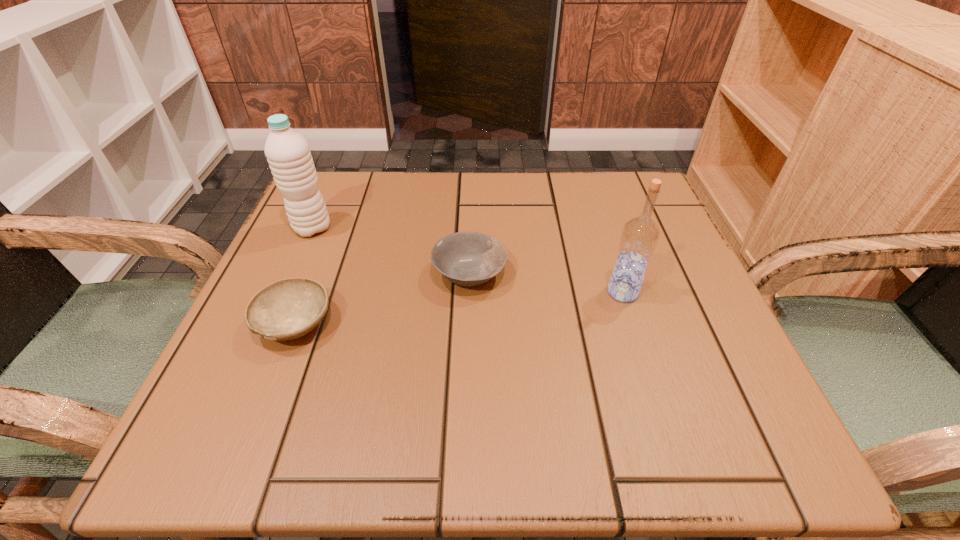
Find the location of a particular element. free space that satisfies the following two spatial constraints: 1. on the back side of the vodka; 2. on the left side of the left bowl is located at coordinates (307, 292).

Locate an element on the screen. free spot that satisfies the following two spatial constraints: 1. on the back side of the vodka; 2. on the left side of the left bowl is located at coordinates (307, 292).

At what (x,y) coordinates should I click in order to perform the action: click on vacant space that satisfies the following two spatial constraints: 1. on the back side of the second object from right to left; 2. on the left side of the left bowl. Please return your answer as a coordinate pair (x, y). The height and width of the screenshot is (540, 960). Looking at the image, I should click on (315, 274).

You are a GUI agent. You are given a task and a screenshot of the screen. Output one action in this format:
    pyautogui.click(x=<x>, y=<y>)
    Task: Click on the vacant position in the image that satisfies the following two spatial constraints: 1. on the back side of the left bowl; 2. on the left side of the second object from right to left
    
    Given the screenshot: What is the action you would take?
    pyautogui.click(x=315, y=274)